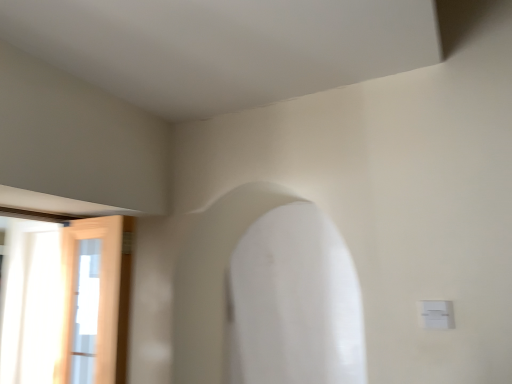
Question: Should I look upward or downward to see white smooth archway at center?

Choices:
 (A) down
 (B) up

Answer: (A)

Question: Considering the relative sizes of white plastic electric outlet at lower right and white smooth archway at center in the image provided, is white plastic electric outlet at lower right taller than white smooth archway at center?

Choices:
 (A) no
 (B) yes

Answer: (A)

Question: Considering the relative positions of white plastic electric outlet at lower right and white smooth archway at center in the image provided, is white plastic electric outlet at lower right to the right of white smooth archway at center from the viewer's perspective?

Choices:
 (A) no
 (B) yes

Answer: (B)

Question: Can you confirm if white plastic electric outlet at lower right is positioned to the left of white smooth archway at center?

Choices:
 (A) yes
 (B) no

Answer: (B)

Question: Is white plastic electric outlet at lower right smaller than white smooth archway at center?

Choices:
 (A) yes
 (B) no

Answer: (A)

Question: Is white plastic electric outlet at lower right thinner than white smooth archway at center?

Choices:
 (A) no
 (B) yes

Answer: (B)

Question: From the image's perspective, is white plastic electric outlet at lower right located beneath white smooth archway at center?

Choices:
 (A) no
 (B) yes

Answer: (B)

Question: Is the position of white smooth archway at center less distant than that of wooden door at left?

Choices:
 (A) yes
 (B) no

Answer: (A)

Question: Could you tell me if white smooth archway at center is facing wooden door at left?

Choices:
 (A) no
 (B) yes

Answer: (A)

Question: Is white smooth archway at center completely or partially outside of wooden door at left?

Choices:
 (A) no
 (B) yes

Answer: (B)

Question: From a real-world perspective, is white smooth archway at center positioned under wooden door at left based on gravity?

Choices:
 (A) yes
 (B) no

Answer: (B)

Question: From the image's perspective, is white smooth archway at center over wooden door at left?

Choices:
 (A) yes
 (B) no

Answer: (A)

Question: Is wooden door at left a part of white smooth archway at center?

Choices:
 (A) no
 (B) yes

Answer: (A)

Question: Considering the relative positions of white smooth archway at center and white plastic electric outlet at lower right in the image provided, is white smooth archway at center to the left of white plastic electric outlet at lower right from the viewer's perspective?

Choices:
 (A) no
 (B) yes

Answer: (B)